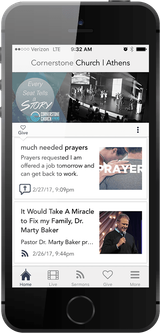
The height and width of the screenshot is (333, 160). I want to click on phone, so click(x=152, y=214).